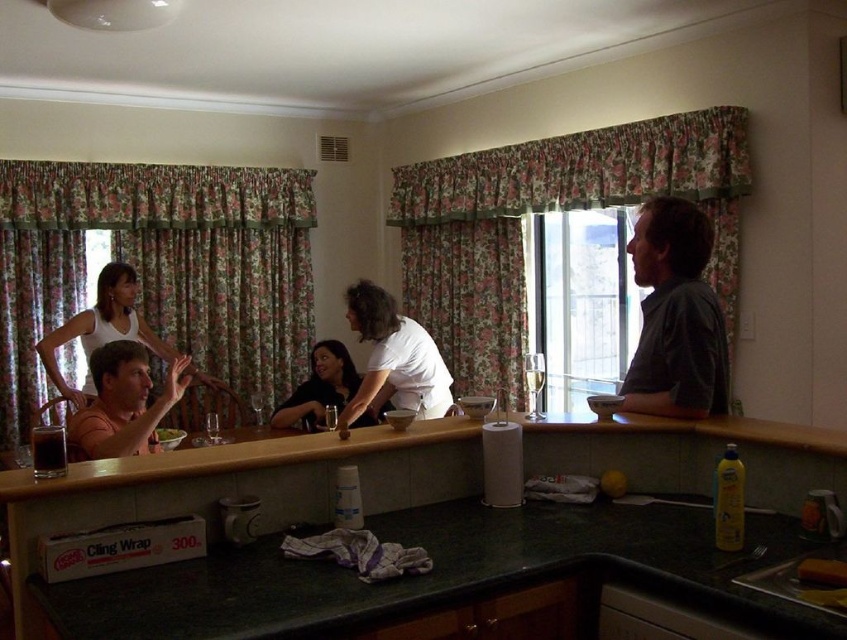
You are organizing items on the dark green countertop in the well lit kitchen. You have a white matte shirt at center and a green leafy salad at center. The shirt needs to be placed away from the salad to prevent any possible spills. Can you fit both items on the countertop without them touching each other?

The white matte shirt at center and green leafy salad at center are 3.49 feet apart from each other, so yes, they can be placed on the countertop without touching since the distance between them is sufficient.

Looking at this image, you are organizing the kitchen and need to place a new item between the dark gray shirt at right and the black plastic sink at lower right. Based on their positions, where should you place the item?

The dark gray shirt at right is to the left of the black plastic sink at lower right, so you should place the new item between them by positioning it to the right of the dark gray shirt at right and to the left of the black plastic sink at lower right.